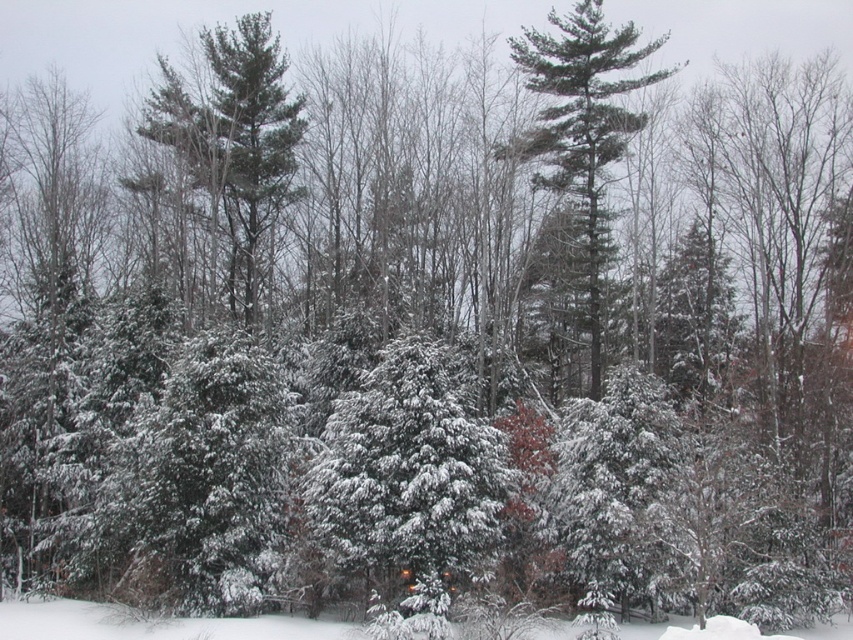
Is green needle-like tree at upper left smaller than green matte tree at center?

Indeed, green needle-like tree at upper left has a smaller size compared to green matte tree at center.

Is point (183, 148) farther from camera compared to point (596, 388)?

No, it is not.

Locate an element on the screen. green needle-like tree at upper left is located at coordinates (234, 140).

Which is more to the right, green needle-like tree at upper left or white fluffy snow at lower center?

Positioned to the right is white fluffy snow at lower center.

Consider the image. Who is more forward, (264,160) or (225,636)?

Point (225,636) is more forward.

You are a GUI agent. You are given a task and a screenshot of the screen. Output one action in this format:
    pyautogui.click(x=<x>, y=<y>)
    Task: Click on the green needle-like tree at upper left
    The height and width of the screenshot is (640, 853).
    Given the screenshot: What is the action you would take?
    pyautogui.click(x=234, y=140)

Based on the photo, which is below, green matte tree at center or white fluffy snow at lower center?

Positioned lower is white fluffy snow at lower center.

Can you confirm if green matte tree at center is thinner than white fluffy snow at lower center?

Correct, green matte tree at center's width is less than white fluffy snow at lower center's.

Is point (509, 38) closer to viewer compared to point (567, 630)?

No, (509, 38) is behind (567, 630).

Identify the location of green matte tree at center. The image size is (853, 640). (582, 125).